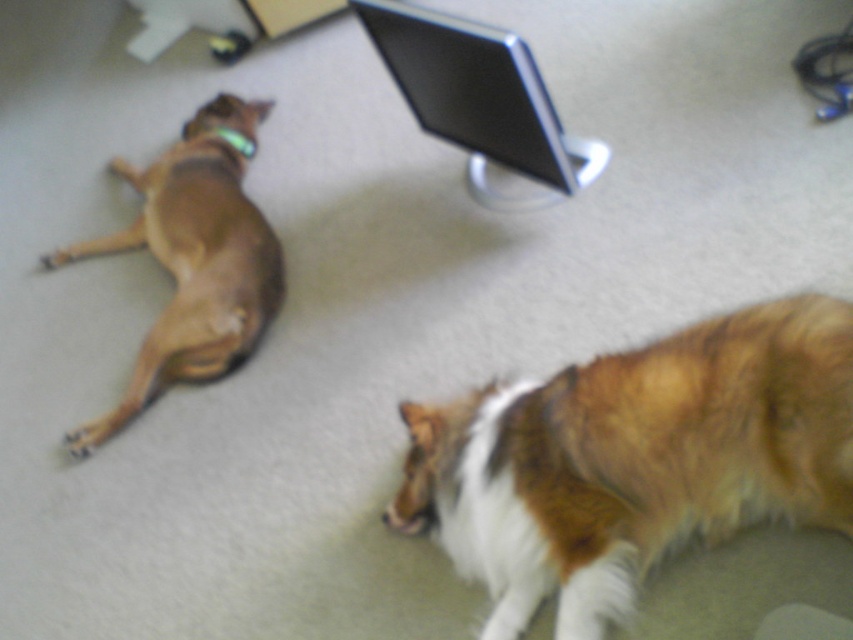
Question: Can you confirm if brown matte dog at left is smaller than black glossy monitor at upper center?

Choices:
 (A) yes
 (B) no

Answer: (B)

Question: Which point is farther from the camera taking this photo?

Choices:
 (A) (541, 161)
 (B) (260, 275)
 (C) (511, 541)

Answer: (B)

Question: Can you confirm if brown fluffy dog at lower right is thinner than black glossy monitor at upper center?

Choices:
 (A) no
 (B) yes

Answer: (A)

Question: Where is brown fluffy dog at lower right located in relation to brown matte dog at left in the image?

Choices:
 (A) above
 (B) below

Answer: (B)

Question: Which object is closer to the camera taking this photo?

Choices:
 (A) brown matte dog at left
 (B) black glossy monitor at upper center
 (C) brown fluffy dog at lower right

Answer: (C)

Question: Which point is closer to the camera taking this photo?

Choices:
 (A) (259, 113)
 (B) (573, 582)

Answer: (B)